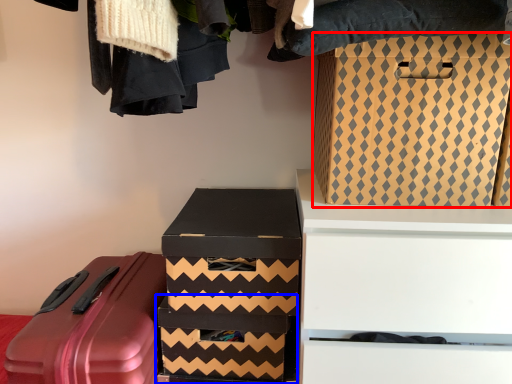
Question: Among these objects, which one is nearest to the camera, box (highlighted by a red box) or box (highlighted by a blue box)?

Choices:
 (A) box
 (B) box

Answer: (A)